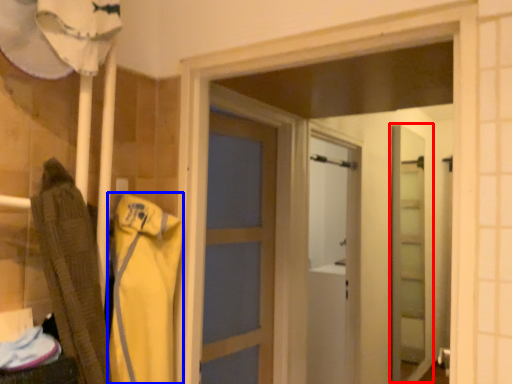
Question: Among these objects, which one is nearest to the camera, screen door (highlighted by a red box) or clothing (highlighted by a blue box)?

Choices:
 (A) screen door
 (B) clothing

Answer: (B)